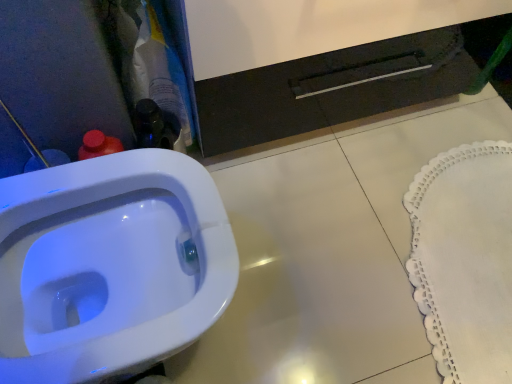
Question: Is white glossy toilet at lower left far away from white lace doily at lower right?

Choices:
 (A) no
 (B) yes

Answer: (A)

Question: Considering the relative positions of white glossy toilet at lower left and white lace doily at lower right in the image provided, is white glossy toilet at lower left behind white lace doily at lower right?

Choices:
 (A) no
 (B) yes

Answer: (A)

Question: Is white glossy toilet at lower left closer to the viewer compared to white lace doily at lower right?

Choices:
 (A) no
 (B) yes

Answer: (B)

Question: Does white glossy toilet at lower left appear on the left side of white lace doily at lower right?

Choices:
 (A) yes
 (B) no

Answer: (A)

Question: Is white glossy toilet at lower left outside white lace doily at lower right?

Choices:
 (A) yes
 (B) no

Answer: (A)

Question: Is white glossy toilet at lower left at the right side of white lace doily at lower right?

Choices:
 (A) yes
 (B) no

Answer: (B)

Question: Is white lace doily at lower right to the left of white glossy toilet at lower left from the viewer's perspective?

Choices:
 (A) yes
 (B) no

Answer: (B)

Question: Is white lace doily at lower right positioned behind white glossy toilet at lower left?

Choices:
 (A) no
 (B) yes

Answer: (B)

Question: From the image's perspective, is white lace doily at lower right located above white glossy toilet at lower left?

Choices:
 (A) yes
 (B) no

Answer: (A)

Question: Considering the relative sizes of white lace doily at lower right and white glossy toilet at lower left in the image provided, is white lace doily at lower right thinner than white glossy toilet at lower left?

Choices:
 (A) yes
 (B) no

Answer: (A)

Question: From a real-world perspective, is white lace doily at lower right physically below white glossy toilet at lower left?

Choices:
 (A) yes
 (B) no

Answer: (A)

Question: From the image's perspective, would you say white lace doily at lower right is shown under white glossy toilet at lower left?

Choices:
 (A) yes
 (B) no

Answer: (B)

Question: Is white lace doily at lower right taller or shorter than white glossy toilet at lower left?

Choices:
 (A) short
 (B) tall

Answer: (A)